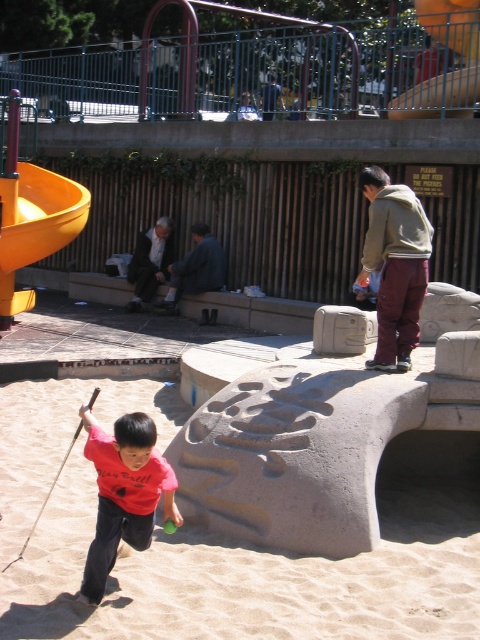
Does point (380, 179) lie behind point (34, 180)?

That is False.

Is point (386, 296) less distant than point (16, 220)?

Yes, it is.

Does point (385, 237) come farther from viewer compared to point (76, 214)?

No.

The height and width of the screenshot is (640, 480). What are the coordinates of `maroon fleece pants at right` in the screenshot? It's located at (395, 266).

Which is behind, point (395, 204) or point (272, 97)?

Positioned behind is point (272, 97).

Is point (405, 241) positioned behind point (269, 102)?

No.

Does point (356, 276) come in front of point (271, 100)?

Yes.

Locate an element on the screen. The height and width of the screenshot is (640, 480). maroon fleece pants at right is located at coordinates (395, 266).

Does red cotton shirt at lower left appear over yellow plastic slide at upper center?

Incorrect, red cotton shirt at lower left is not positioned above yellow plastic slide at upper center.

Does red cotton shirt at lower left have a smaller size compared to yellow plastic slide at upper center?

Yes.

You are a GUI agent. You are given a task and a screenshot of the screen. Output one action in this format:
    pyautogui.click(x=<x>, y=<y>)
    Task: Click on the red cotton shirt at lower left
    The image size is (480, 640).
    Given the screenshot: What is the action you would take?
    pyautogui.click(x=123, y=492)